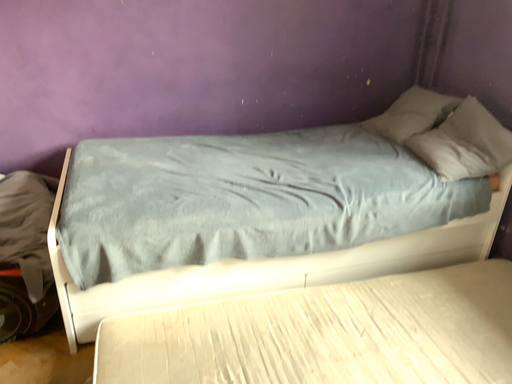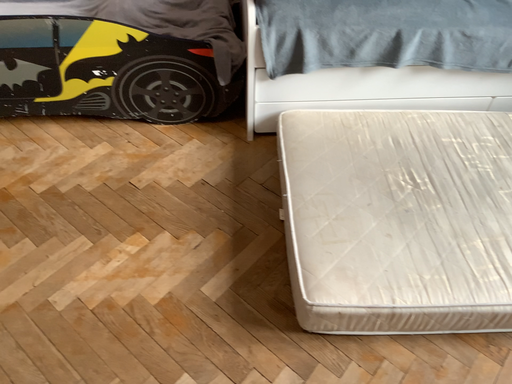
Question: Which way did the camera rotate in the video?

Choices:
 (A) rotated left
 (B) rotated right

Answer: (A)